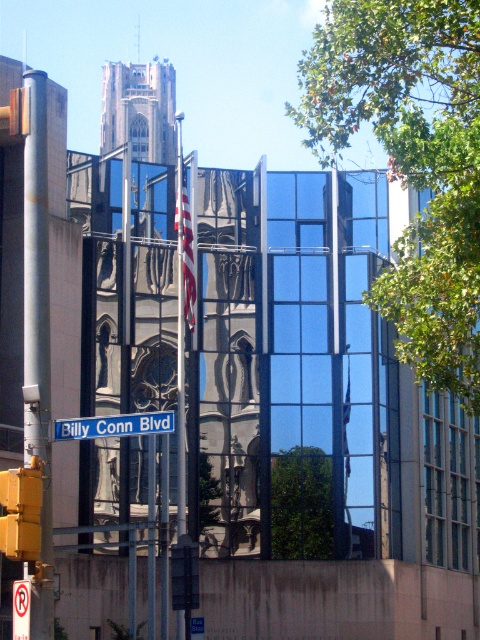
You are standing in front of the building with reflective glass windows. There are two points marked on the glass at coordinates point [462,310] and point [76,428]. Which point is closer to you?

Point [76,428] is closer to you because it is less further to the camera than point [462,310].

You are a pedestrian standing on the sidewalk and looking at the green leafy tree at upper right and the blue plastic street sign at center. Which object is higher up in the image?

The green leafy tree at upper right is above the blue plastic street sign at center, so it is higher up in the image.